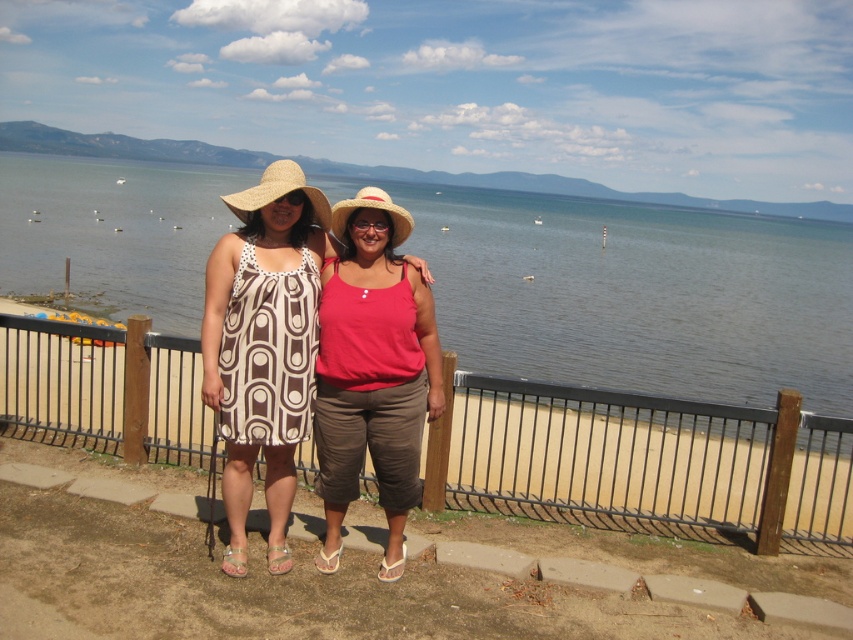
Question: Does blue water at center have a larger size compared to brown textured dress at center?

Choices:
 (A) no
 (B) yes

Answer: (B)

Question: Can you confirm if metallic black fence at center is positioned above brown textured dress at center?

Choices:
 (A) no
 (B) yes

Answer: (A)

Question: Which of the following is the farthest from the observer?

Choices:
 (A) (355, 445)
 (B) (129, 193)

Answer: (B)

Question: Based on their relative distances, which object is nearer to the blue water at center?

Choices:
 (A) matte pink tank top at center
 (B) brown textured dress at center

Answer: (B)

Question: Which point is farther from the camera taking this photo?

Choices:
 (A) (792, 256)
 (B) (403, 285)
 (C) (183, 419)
 (D) (244, 365)

Answer: (A)

Question: Can you confirm if blue water at center is positioned above metallic black fence at center?

Choices:
 (A) no
 (B) yes

Answer: (B)